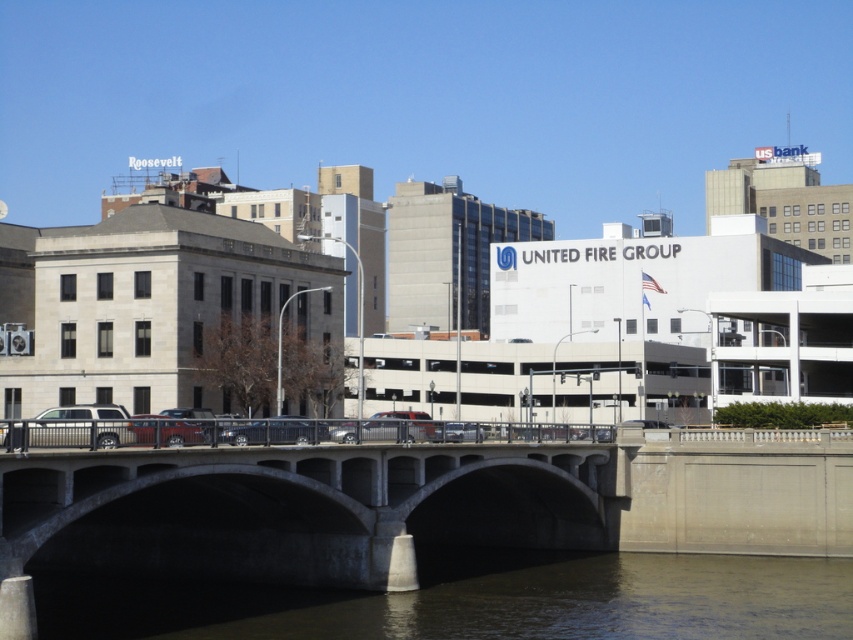
Which is more to the left, concrete bridge at center or silver metallic suv at center?

From the viewer's perspective, silver metallic suv at center appears more on the left side.

Does concrete bridge at center come in front of silver metallic suv at center?

Yes, concrete bridge at center is closer to the viewer.

Between point (283, 500) and point (22, 445), which one is positioned behind?

The point (283, 500) is more distant.

Locate an element on the screen. concrete bridge at center is located at coordinates (300, 508).

From the picture: Can you confirm if concrete bridge at center is thinner than brown concrete river at lower center?

Indeed, concrete bridge at center has a lesser width compared to brown concrete river at lower center.

Does concrete bridge at center come behind brown concrete river at lower center?

No, it is not.

Is point (331, 481) more distant than point (838, 609)?

Yes.

Find the location of a particular element. The image size is (853, 640). concrete bridge at center is located at coordinates (300, 508).

Does brown concrete river at lower center have a smaller size compared to silver metallic suv at center?

Actually, brown concrete river at lower center might be larger than silver metallic suv at center.

Is point (460, 624) farther from viewer compared to point (108, 429)?

Yes, it is behind point (108, 429).

The height and width of the screenshot is (640, 853). I want to click on brown concrete river at lower center, so click(479, 600).